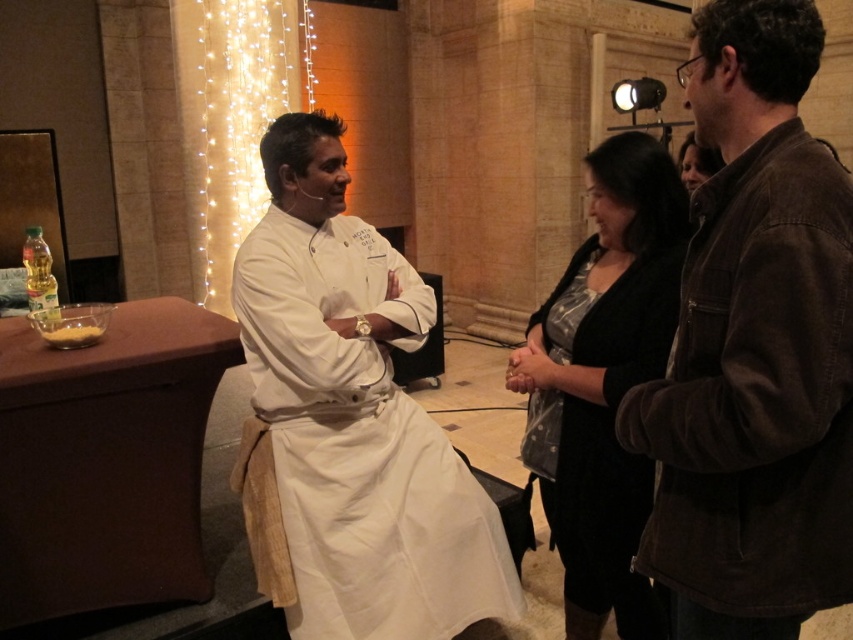
Question: Can you confirm if brown suede jacket at right is positioned above white cotton chef's coat at center?

Choices:
 (A) no
 (B) yes

Answer: (B)

Question: Does brown suede jacket at right have a smaller size compared to white cotton chef's coat at center?

Choices:
 (A) no
 (B) yes

Answer: (B)

Question: Which is nearer to the brown suede jacket at right?

Choices:
 (A) white cotton chef's coat at center
 (B) black textured sweater at center

Answer: (B)

Question: Which is nearer to the brown suede jacket at right?

Choices:
 (A) white cotton chef's coat at center
 (B) black textured sweater at center

Answer: (B)

Question: Which point is farther to the camera?

Choices:
 (A) (627, 332)
 (B) (746, 52)

Answer: (A)

Question: In this image, where is white cotton chef's coat at center located relative to black textured sweater at center?

Choices:
 (A) above
 (B) below

Answer: (B)